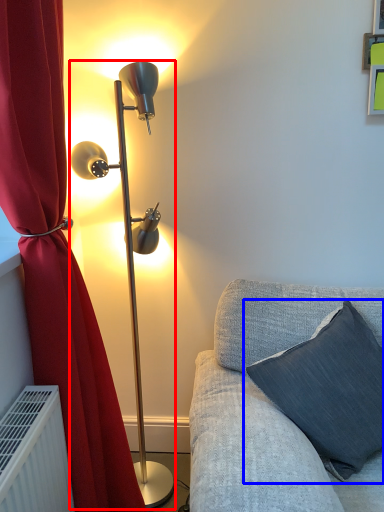
Question: Which object is further to the camera taking this photo, lamp (highlighted by a red box) or pillow (highlighted by a blue box)?

Choices:
 (A) lamp
 (B) pillow

Answer: (A)